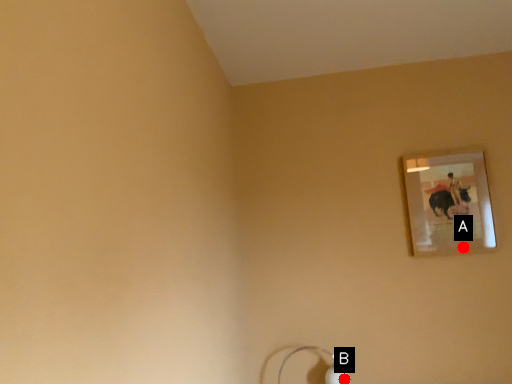
Question: Two points are circled on the image, labeled by A and B beside each circle. Which point is closer to the camera?

Choices:
 (A) A is closer
 (B) B is closer

Answer: (A)